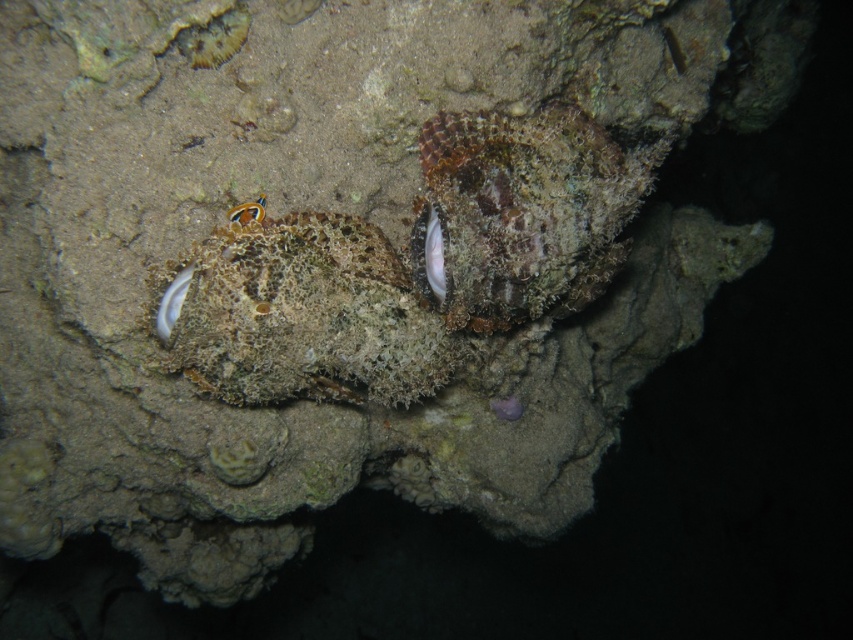
Which of these two, camouflage-patterned stonefish at center or orange coral at center, stands taller?

Standing taller between the two is camouflage-patterned stonefish at center.

Where is `camouflage-patterned stonefish at center`? Image resolution: width=853 pixels, height=640 pixels. camouflage-patterned stonefish at center is located at coordinates (409, 266).